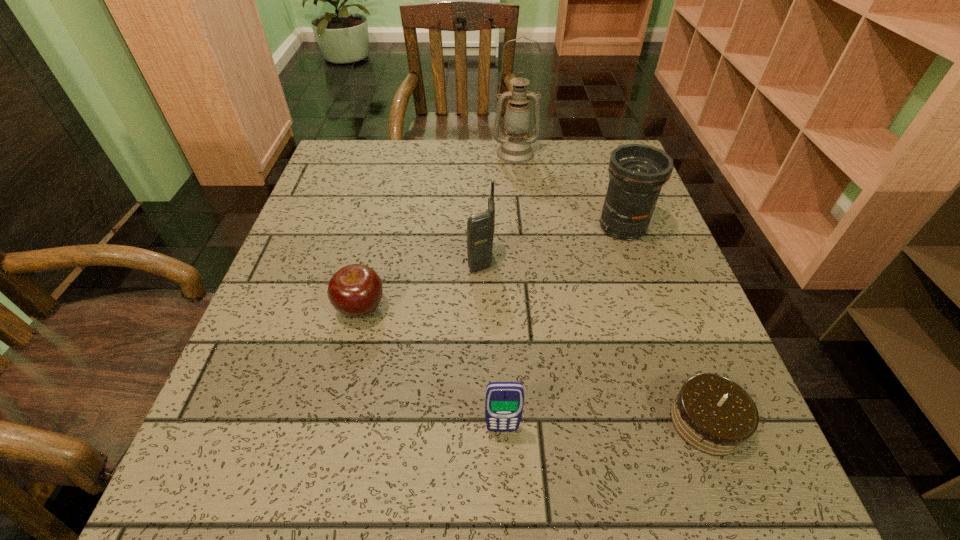
At what (x,y) coordinates should I click in order to perform the action: click on vacant space that satisfies the following two spatial constraints: 1. on the front side of the oil lamp; 2. on the keyboard of the taller cellular telephone. Please return your answer as a coordinate pair (x, y). The width and height of the screenshot is (960, 540). Looking at the image, I should click on (527, 260).

Locate an element on the screen. This screenshot has height=540, width=960. free region that satisfies the following two spatial constraints: 1. on the keyboard of the fourth nearest object; 2. on the right side of the shortest object is located at coordinates (482, 422).